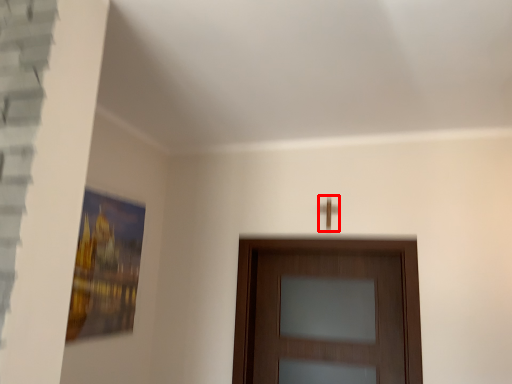
Question: In this image, where is door handle (annotated by the red box) located relative to door?

Choices:
 (A) right
 (B) left

Answer: (A)